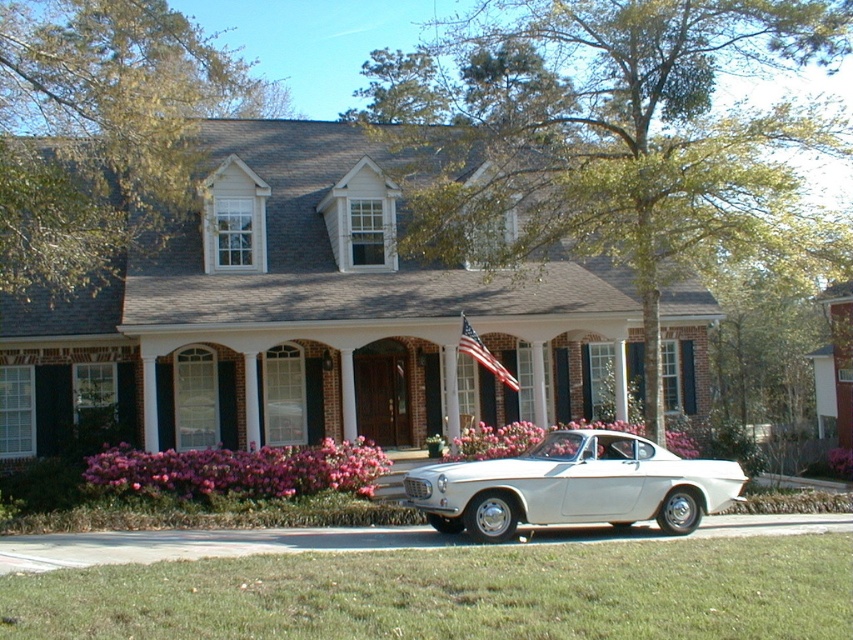
You are standing at the driveway of the suburban house. You want to place a decorative garden statue that is 1.2 meters tall. The statue requires a flat area of at least 1 square meter to be placed. Is there enough space at the location marked by point (518, 436)?

The location at point (518, 436) has pink matte flowers at center. Since the flowers are present, the area might not be flat or clear enough to accommodate the statue requiring 1 square meter. Therefore, it might not be suitable.

You are standing in front of the suburban house and want to take a photo. There are two points marked in the scene, point 1 at coordinates point [180,490] and point 2 at coordinates point [482,348]. Which point is closer to you?

Point [180,490] is closer to the camera than point [482,348], so the point closer to you is point [180,490].